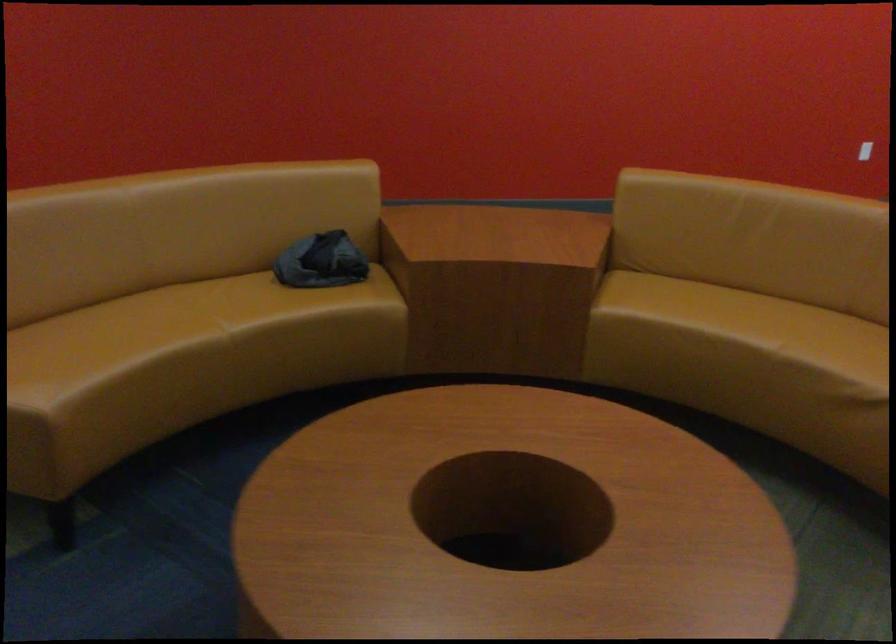
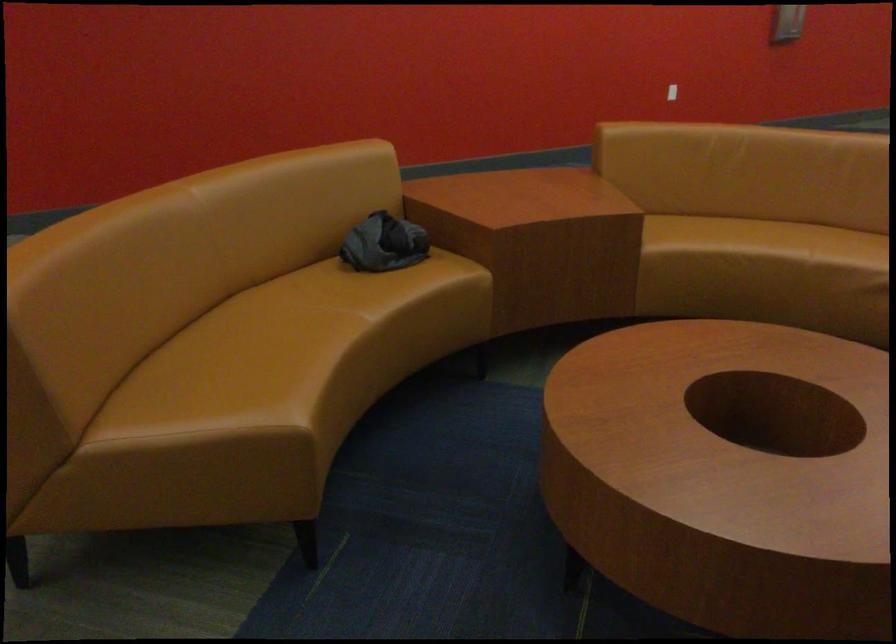
Locate, in the second image, the point that corresponds to point (309, 261) in the first image.

(383, 243)